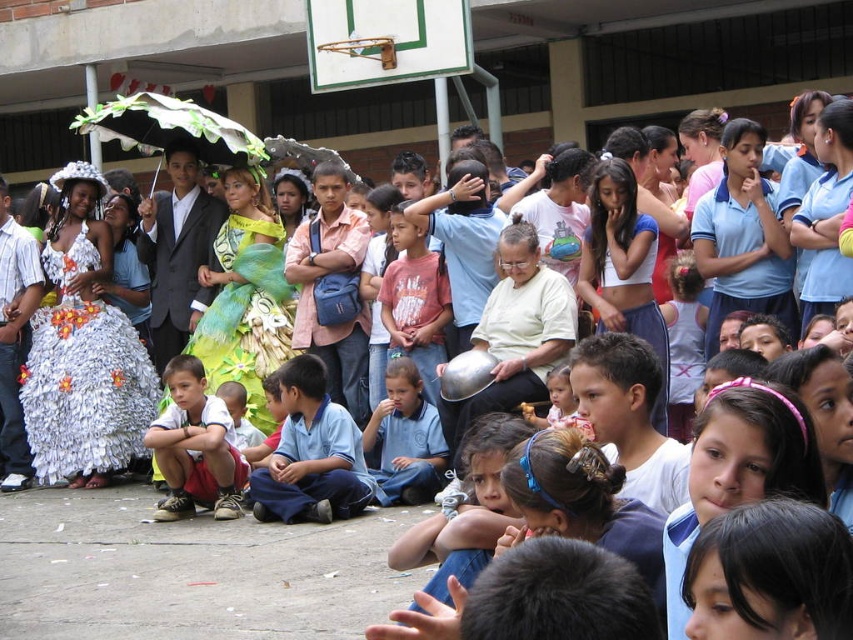
Question: Which of these objects is positioned closest to the light blue uniform at center?

Choices:
 (A) green feathered dress at center
 (B) white fluffy dress at left
 (C) green leafy umbrella at center
 (D) red cotton shirt at center

Answer: (A)

Question: Estimate the real-world distances between objects in this image. Which object is closer to the white fluffy dress at left?

Choices:
 (A) red cotton shirt at center
 (B) blue uniform shirt at center
 (C) green leafy umbrella at center
 (D) light blue uniform at center

Answer: (D)

Question: Is white fluffy dress at left to the left of blue uniform shirt at center from the viewer's perspective?

Choices:
 (A) no
 (B) yes

Answer: (B)

Question: From the image, what is the correct spatial relationship of light blue uniform at center in relation to blue uniform shirt at center?

Choices:
 (A) right
 (B) left

Answer: (B)

Question: Estimate the real-world distances between objects in this image. Which object is farther from the blue uniform shirt at center?

Choices:
 (A) light blue uniform at center
 (B) green leafy umbrella at center
 (C) green feathered dress at center
 (D) white fluffy dress at left

Answer: (B)

Question: Does white fluffy dress at left have a greater width compared to blue uniform shirt at center?

Choices:
 (A) no
 (B) yes

Answer: (B)